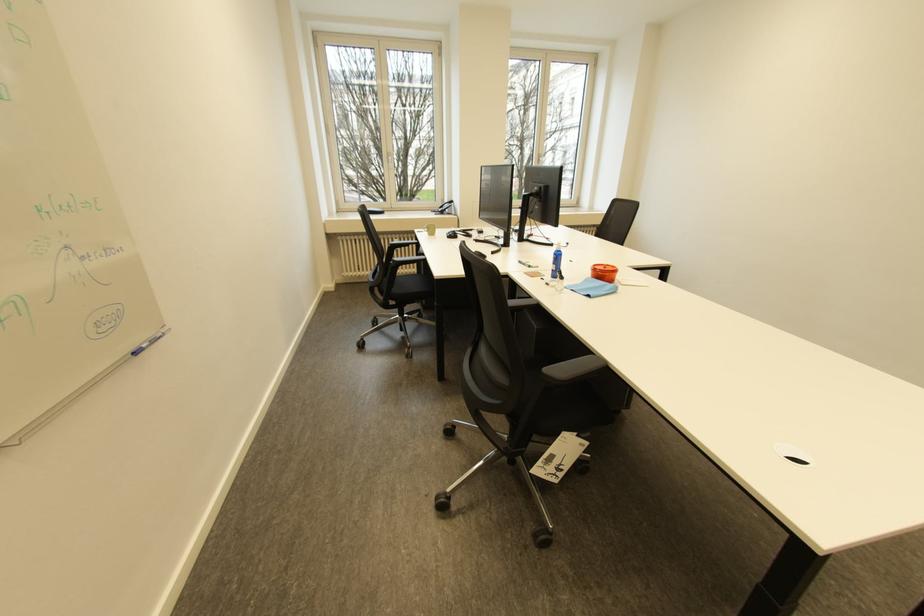
Where would you lift the blue whiteboard marker? Please return your answer as a coordinate pair (x, y).

(149, 342)